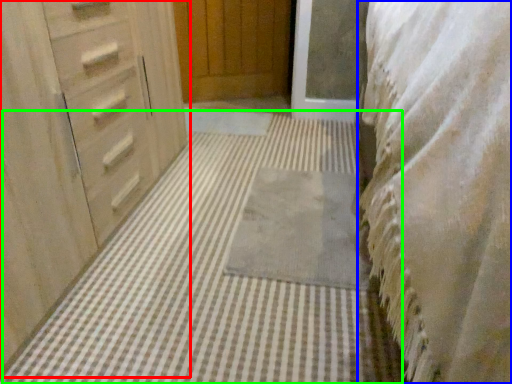
Question: Based on their relative distances, which object is farther from chest of drawers (highlighted by a red box)? Choose from bedding (highlighted by a blue box) and bath mat (highlighted by a green box).

Choices:
 (A) bedding
 (B) bath mat

Answer: (A)